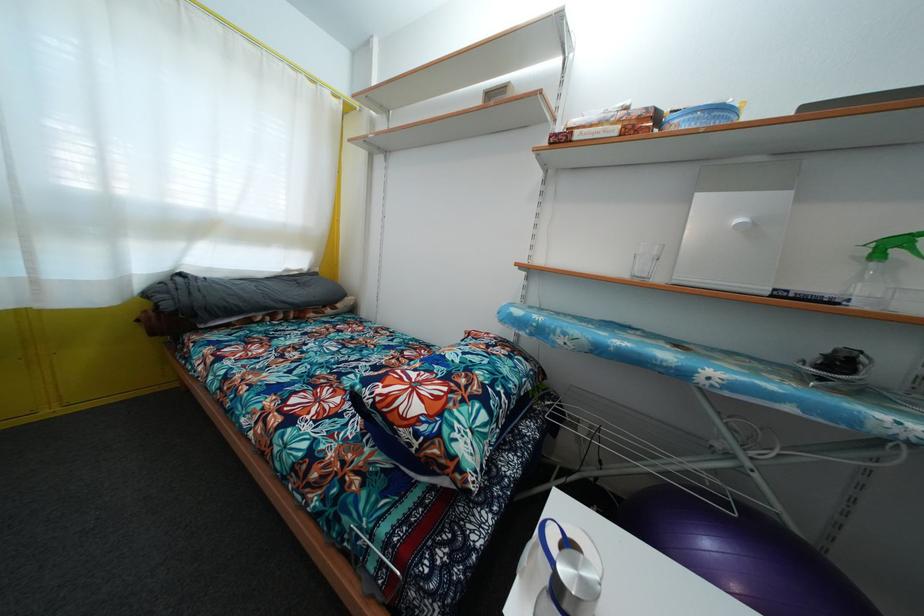
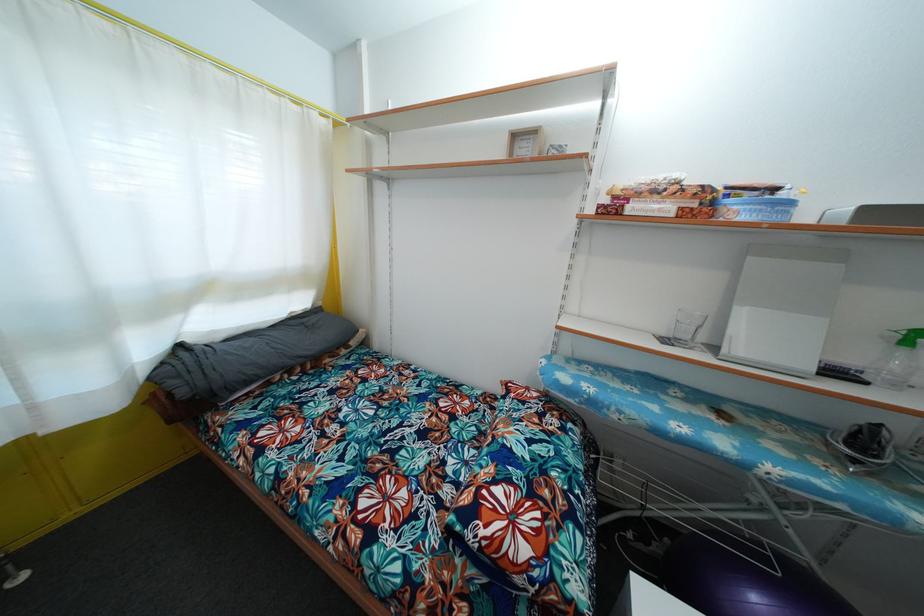
Where in the second image is the point corresponding to point 679,128 from the first image?

(738, 214)